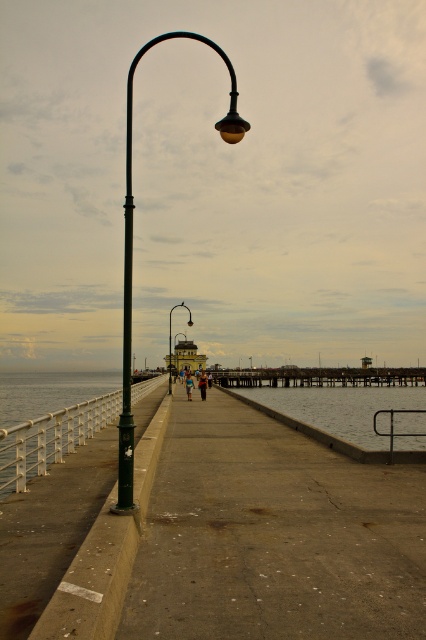
Is clear water at lower center positioned behind metallic pole at center?

No, it is not.

Does clear water at lower center appear on the right side of metallic pole at center?

Yes, clear water at lower center is to the right of metallic pole at center.

Who is more forward, (425,419) or (239,358)?

Point (425,419) is in front.

Image resolution: width=426 pixels, height=640 pixels. Identify the location of clear water at lower center. (336, 412).

Can you confirm if black metal rail at lower center is positioned below metallic pole at center?

Incorrect, black metal rail at lower center is not positioned below metallic pole at center.

Between black metal rail at lower center and metallic pole at center, which one is positioned lower?

metallic pole at center is below.

Is point (374, 413) positioned in front of point (238, 362)?

Yes, point (374, 413) is in front of point (238, 362).

Where is `black metal rail at lower center`? The height and width of the screenshot is (640, 426). black metal rail at lower center is located at coordinates (393, 426).

Between concrete dock at center and matte black street light at left, which one has less height?

Standing shorter between the two is concrete dock at center.

Can you confirm if concrete dock at center is shorter than matte black street light at left?

Yes.

Does point (259, 529) lie in front of point (175, 339)?

That is True.

I want to click on concrete dock at center, so click(273, 536).